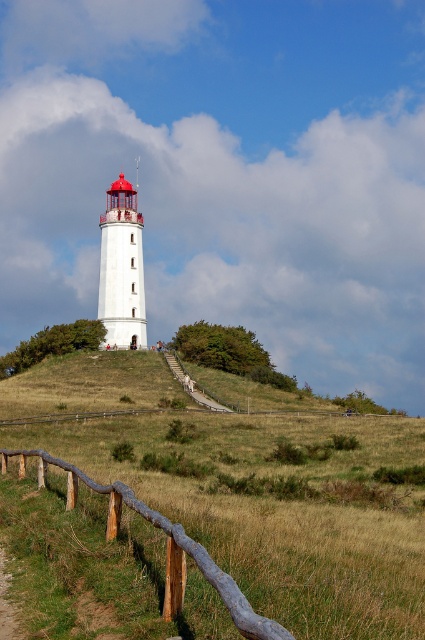
Question: Which point is closer to the camera?

Choices:
 (A) rustic wooden fence at lower left
 (B) white matte lighthouse at center
 (C) wooden stairs at center
 (D) grassy hillside at center

Answer: (A)

Question: Does rustic wooden fence at lower left appear under white matte lighthouse at center?

Choices:
 (A) no
 (B) yes

Answer: (B)

Question: Which point is farther to the camera?

Choices:
 (A) (107, 344)
 (B) (161, 376)

Answer: (A)

Question: Among these objects, which one is farthest from the camera?

Choices:
 (A) white matte lighthouse at center
 (B) rustic wooden fence at lower left
 (C) wooden stairs at center
 (D) grassy hillside at center

Answer: (A)

Question: Does white matte lighthouse at center come in front of wooden stairs at center?

Choices:
 (A) no
 (B) yes

Answer: (A)

Question: Observing the image, what is the correct spatial positioning of rustic wooden fence at lower left in reference to wooden stairs at center?

Choices:
 (A) left
 (B) right

Answer: (B)